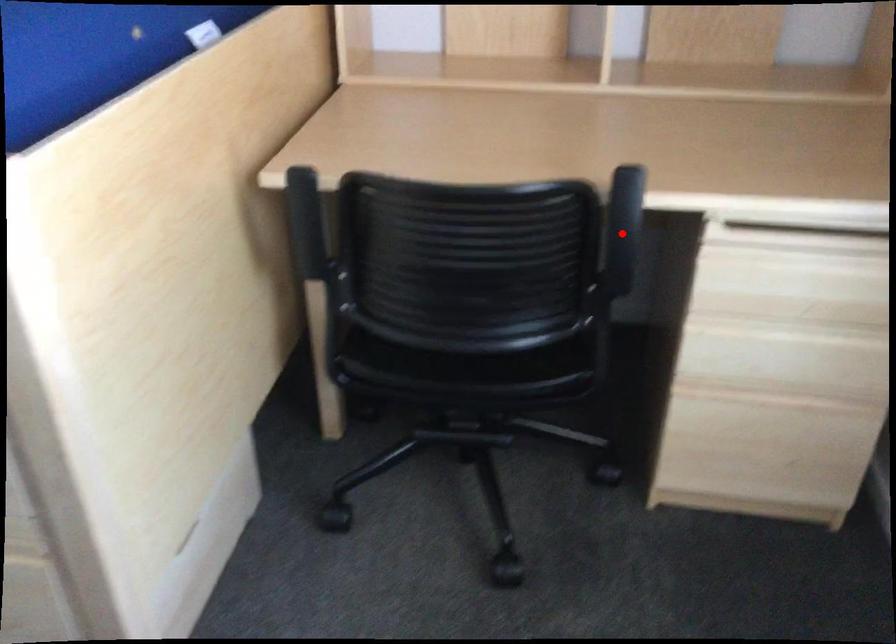
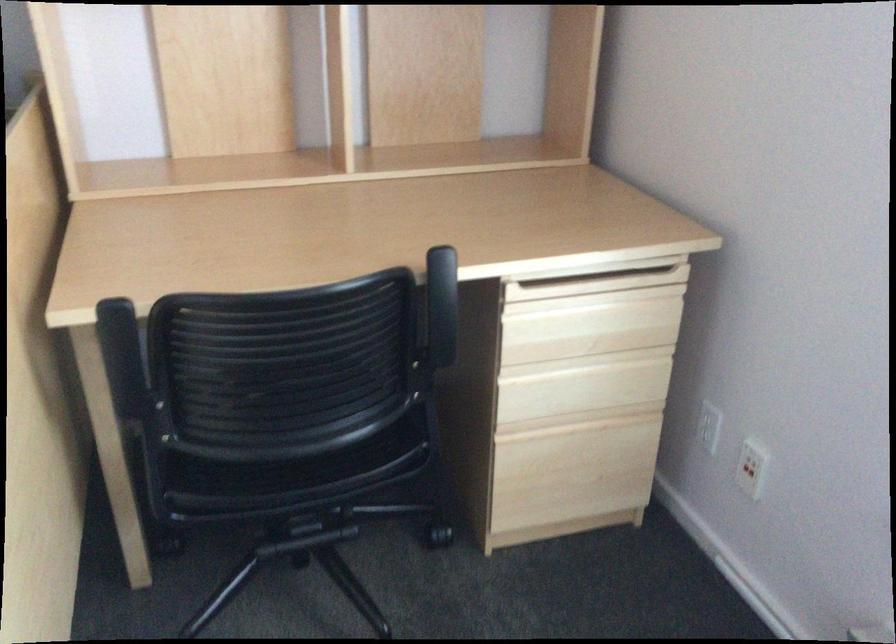
The point at the highlighted location is marked in the first image. Where is the corresponding point in the second image?

(441, 306)